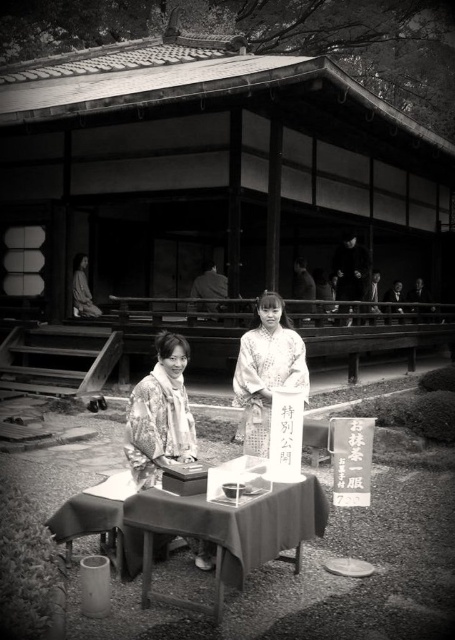
Does smooth wooden table at center appear on the left side of floral kimono at center?

In fact, smooth wooden table at center is to the right of floral kimono at center.

Can you confirm if smooth wooden table at center is shorter than floral kimono at center?

Yes.

Who is more distant from viewer, [218,547] or [157,368]?

Point [157,368]

This screenshot has width=455, height=640. In order to click on smooth wooden table at center in this screenshot , I will do tap(231, 531).

Does point (253, 518) come closer to viewer compared to point (297, 385)?

Yes.

Measure the distance between smooth wooden table at center and silky white kimono at center.

smooth wooden table at center is 7.13 feet away from silky white kimono at center.

Which is in front, point (226, 566) or point (256, 440)?

Point (226, 566)

Locate an element on the screen. smooth wooden table at center is located at coordinates (231, 531).

Locate an element on the screen. floral kimono at center is located at coordinates 160,413.